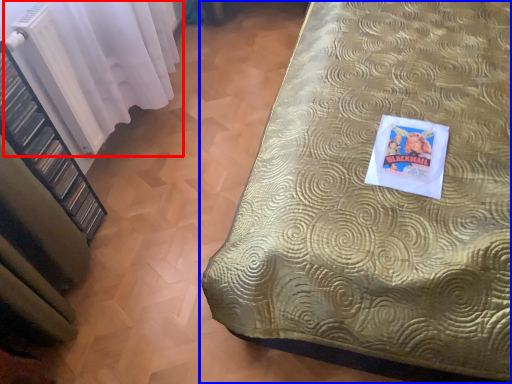
Question: Which object is further to the camera taking this photo, curtain (highlighted by a red box) or bed (highlighted by a blue box)?

Choices:
 (A) curtain
 (B) bed

Answer: (A)